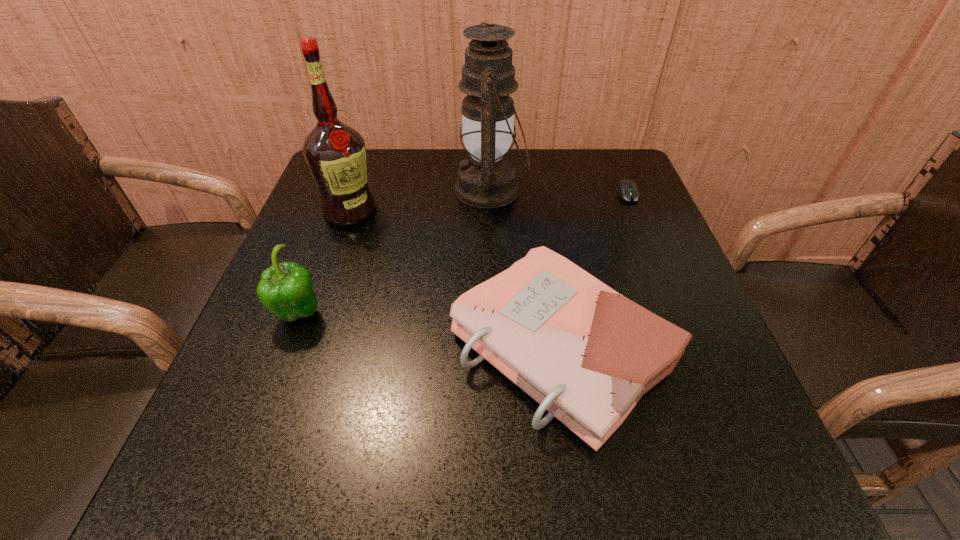
At what (x,y) coordinates should I click in order to perform the action: click on oil lamp that is at the far edge. Please return your answer as a coordinate pair (x, y). The width and height of the screenshot is (960, 540). Looking at the image, I should click on (486, 180).

Find the location of a particular element. The width and height of the screenshot is (960, 540). alcohol positioned at the far edge is located at coordinates (335, 153).

Image resolution: width=960 pixels, height=540 pixels. In order to click on computer mouse located at the far edge in this screenshot , I will do `click(627, 189)`.

Locate an element on the screen. This screenshot has width=960, height=540. object that is at the near edge is located at coordinates (587, 354).

The width and height of the screenshot is (960, 540). I want to click on alcohol at the left edge, so click(x=335, y=153).

This screenshot has height=540, width=960. Find the location of `bell pepper that is at the left edge`. bell pepper that is at the left edge is located at coordinates (285, 289).

The height and width of the screenshot is (540, 960). Identify the location of phonebook at the right edge. (587, 354).

This screenshot has height=540, width=960. Find the location of `computer mouse that is at the right edge`. computer mouse that is at the right edge is located at coordinates (627, 189).

Locate an element on the screen. The image size is (960, 540). object situated at the far left corner is located at coordinates (335, 153).

Locate an element on the screen. Image resolution: width=960 pixels, height=540 pixels. object at the far right corner is located at coordinates [x=627, y=189].